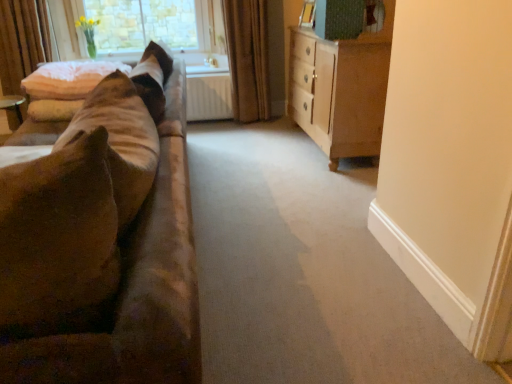
Question: Does suede-like brown couch at left lie behind light brown wood dresser at right?

Choices:
 (A) yes
 (B) no

Answer: (B)

Question: From the image's perspective, would you say suede-like brown couch at left is positioned over light brown wood dresser at right?

Choices:
 (A) no
 (B) yes

Answer: (A)

Question: Does suede-like brown couch at left have a greater height compared to light brown wood dresser at right?

Choices:
 (A) yes
 (B) no

Answer: (B)

Question: Is light brown wood dresser at right surrounded by suede-like brown couch at left?

Choices:
 (A) yes
 (B) no

Answer: (B)

Question: From the image's perspective, is suede-like brown couch at left under light brown wood dresser at right?

Choices:
 (A) yes
 (B) no

Answer: (A)

Question: From the image's perspective, is suede-like brown couch at left located above or below white fluffy pillow at upper left?

Choices:
 (A) above
 (B) below

Answer: (B)

Question: In terms of size, does suede-like brown couch at left appear bigger or smaller than white fluffy pillow at upper left?

Choices:
 (A) small
 (B) big

Answer: (B)

Question: In terms of height, does suede-like brown couch at left look taller or shorter compared to white fluffy pillow at upper left?

Choices:
 (A) tall
 (B) short

Answer: (A)

Question: Is suede-like brown couch at left in front of or behind white fluffy pillow at upper left in the image?

Choices:
 (A) front
 (B) behind

Answer: (A)

Question: In terms of width, does brown textured curtain at center look wider or thinner when compared to white fluffy pillow at upper left?

Choices:
 (A) thin
 (B) wide

Answer: (A)

Question: Considering the positions of point (263, 86) and point (51, 86), is point (263, 86) closer or farther from the camera than point (51, 86)?

Choices:
 (A) farther
 (B) closer

Answer: (A)

Question: From a real-world perspective, is brown textured curtain at center above or below white fluffy pillow at upper left?

Choices:
 (A) above
 (B) below

Answer: (B)

Question: Is brown textured curtain at center bigger or smaller than white fluffy pillow at upper left?

Choices:
 (A) small
 (B) big

Answer: (B)

Question: Is light brown wood dresser at right spatially inside clear glass window at upper left, or outside of it?

Choices:
 (A) outside
 (B) inside

Answer: (A)

Question: Based on their positions, is light brown wood dresser at right located to the left or right of clear glass window at upper left?

Choices:
 (A) right
 (B) left

Answer: (A)